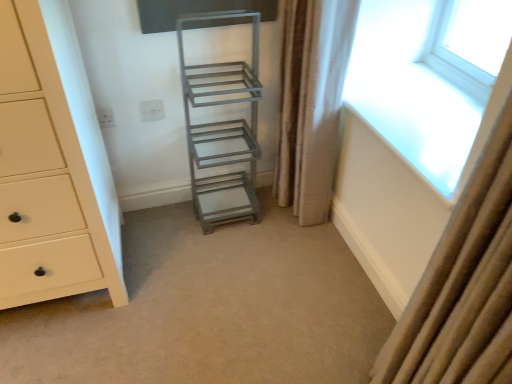
You are a GUI agent. You are given a task and a screenshot of the screen. Output one action in this format:
    pyautogui.click(x=<x>, y=<y>)
    Task: Click on the free spot in front of metallic gray shelf at center
    
    Given the screenshot: What is the action you would take?
    pyautogui.click(x=226, y=256)